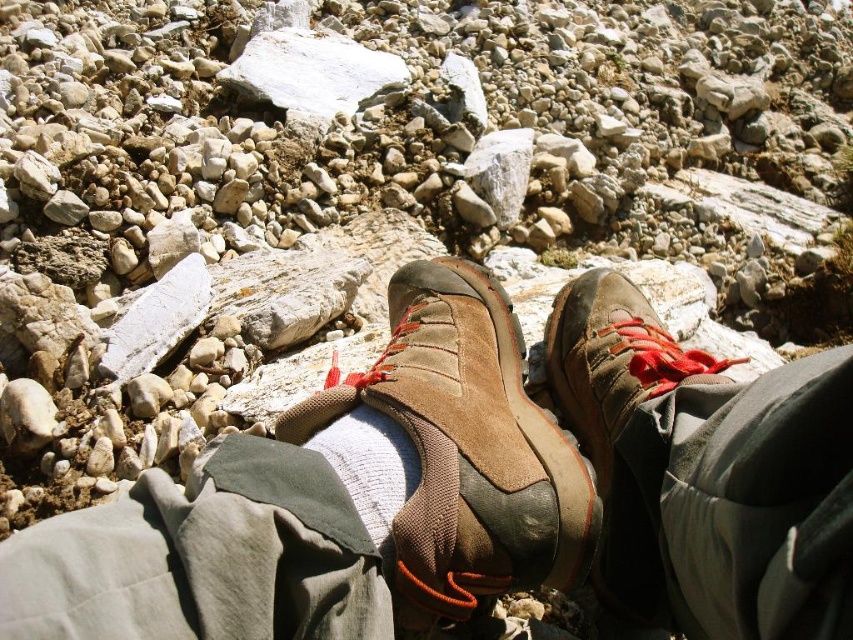
Question: Among these objects, which one is nearest to the camera?

Choices:
 (A) white cotton sock at center
 (B) brown suede shoe at center
 (C) brown suede shoes at center
 (D) suede/leather boot at center

Answer: (C)

Question: Can you confirm if suede/leather boot at center is thinner than brown suede shoe at center?

Choices:
 (A) yes
 (B) no

Answer: (B)

Question: Does brown suede shoes at center have a lesser width compared to brown suede shoe at center?

Choices:
 (A) no
 (B) yes

Answer: (A)

Question: Among these points, which one is farthest from the camera?

Choices:
 (A) (416, 477)
 (B) (515, 372)
 (C) (596, 280)

Answer: (C)

Question: Which point is farther to the camera?

Choices:
 (A) (590, 307)
 (B) (567, 477)
 (C) (374, 536)

Answer: (A)

Question: Observing the image, what is the correct spatial positioning of brown suede shoe at center in reference to white cotton sock at center?

Choices:
 (A) above
 (B) below

Answer: (A)